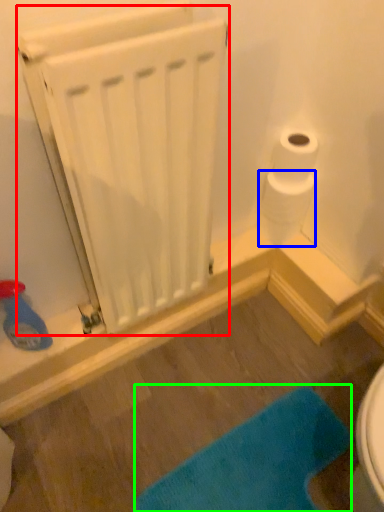
Question: Which object is positioned farthest from radiator (highlighted by a red box)? Select from toilet paper (highlighted by a blue box) and bath mat (highlighted by a green box).

Choices:
 (A) toilet paper
 (B) bath mat

Answer: (B)